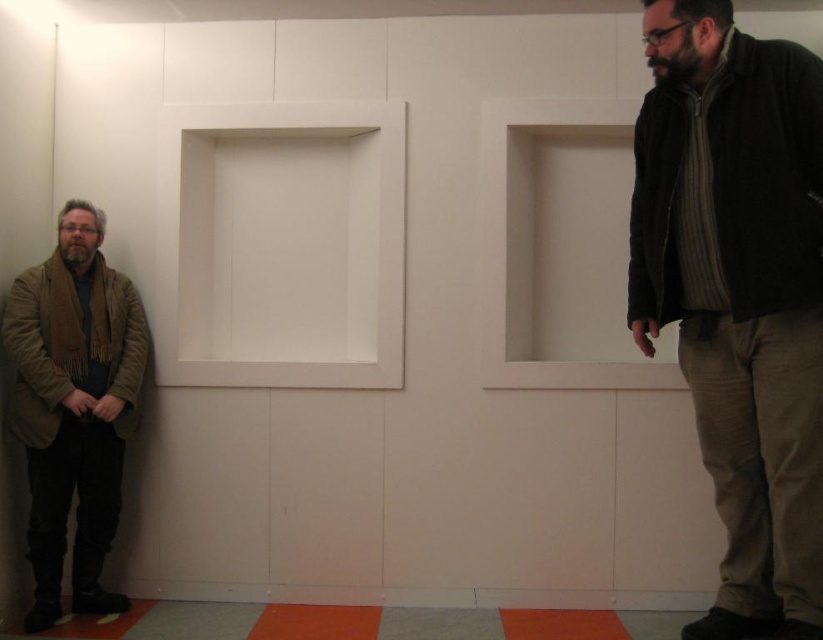
Question: Which point is closer to the camera?

Choices:
 (A) [x=761, y=301]
 (B) [x=775, y=346]
 (C) [x=3, y=339]
 (D) [x=64, y=410]

Answer: (A)

Question: Among these objects, which one is nearest to the camera?

Choices:
 (A) black fuzzy jacket at upper right
 (B) brown corduroy jacket at left
 (C) dark brown leather jacket at right

Answer: (A)

Question: Is dark brown leather jacket at right behind brown leather jacket at lower left?

Choices:
 (A) yes
 (B) no

Answer: (B)

Question: Is brown corduroy jacket at left bigger than black fuzzy jacket at upper right?

Choices:
 (A) no
 (B) yes

Answer: (B)

Question: Does black fuzzy jacket at upper right appear on the left side of brown leather jacket at lower left?

Choices:
 (A) yes
 (B) no

Answer: (B)

Question: Which of these objects is positioned closest to the brown leather jacket at lower left?

Choices:
 (A) dark brown leather jacket at right
 (B) brown corduroy jacket at left
 (C) black fuzzy jacket at upper right

Answer: (B)